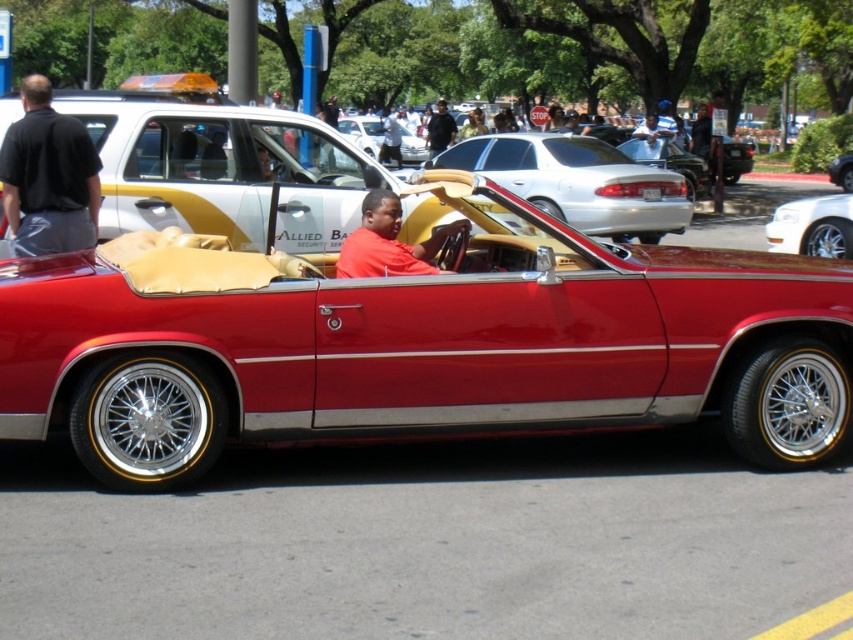
Question: Can you confirm if beige leather convertible at center is positioned above shiny beige leather convertible at center?

Choices:
 (A) no
 (B) yes

Answer: (A)

Question: Estimate the real-world distances between objects in this image. Which object is farther from the dark gray shirt at left?

Choices:
 (A) shiny beige leather convertible at center
 (B) white glossy sedan at right
 (C) matte black shirt at center

Answer: (A)

Question: Which of these objects is positioned farthest from the shiny beige leather convertible at center?

Choices:
 (A) beige leather convertible at center
 (B) shiny red convertible at center

Answer: (B)

Question: Can you confirm if matte red shirt at center is positioned above shiny beige leather convertible at center?

Choices:
 (A) yes
 (B) no

Answer: (B)

Question: Can you confirm if white glossy sedan at right is thinner than matte black shirt at center?

Choices:
 (A) no
 (B) yes

Answer: (A)

Question: Based on their relative distances, which object is farther from the matte black shirt at center?

Choices:
 (A) shiny red convertible at center
 (B) beige leather convertible at center
 (C) white glossy sedan at right

Answer: (A)